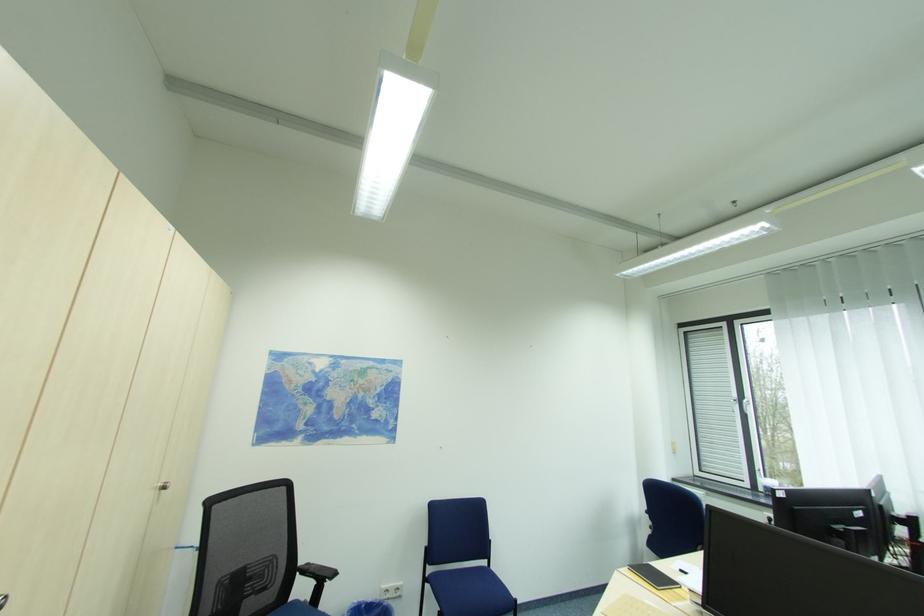
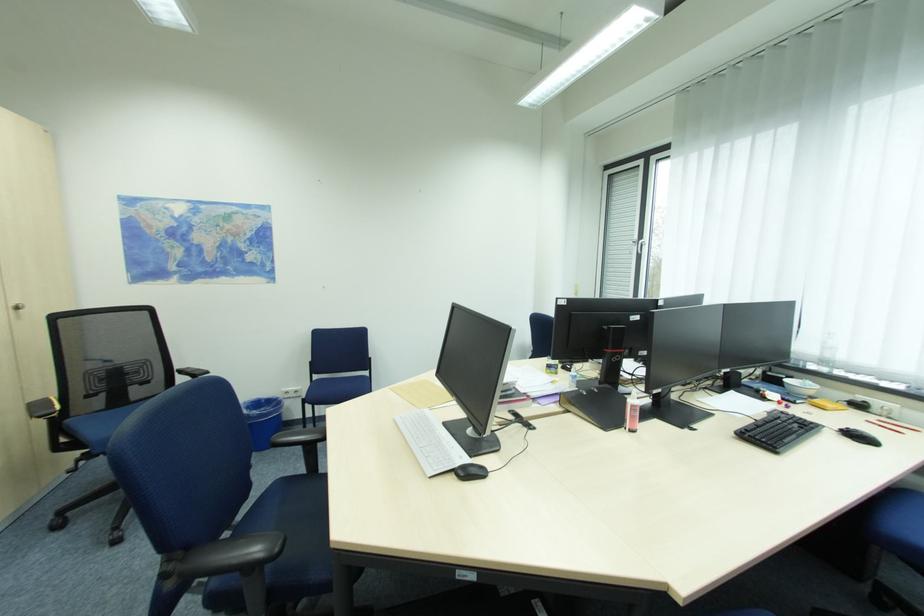
Question: What movement of the cameraman would produce the second image?

Choices:
 (A) Left
 (B) Right
 (C) Forward
 (D) Backward

Answer: (B)